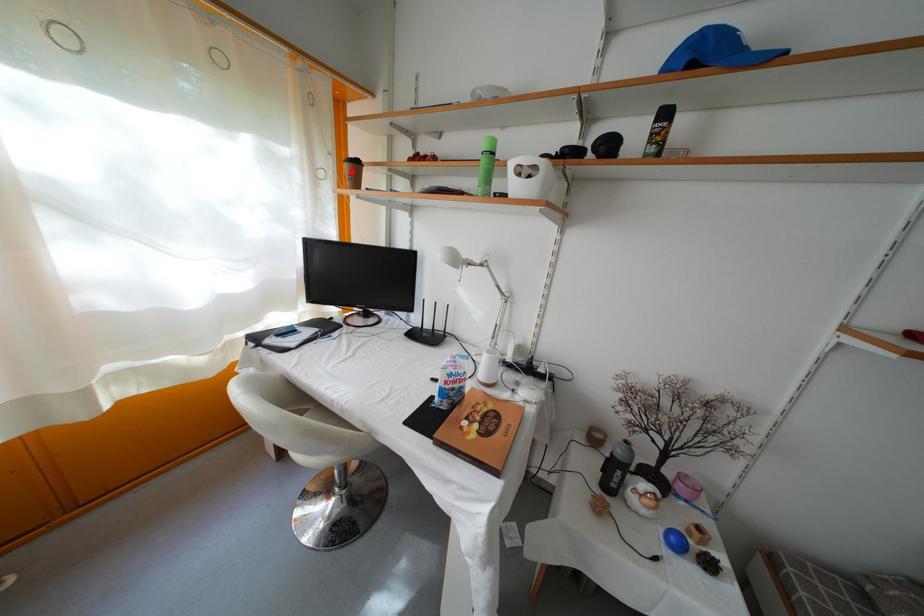
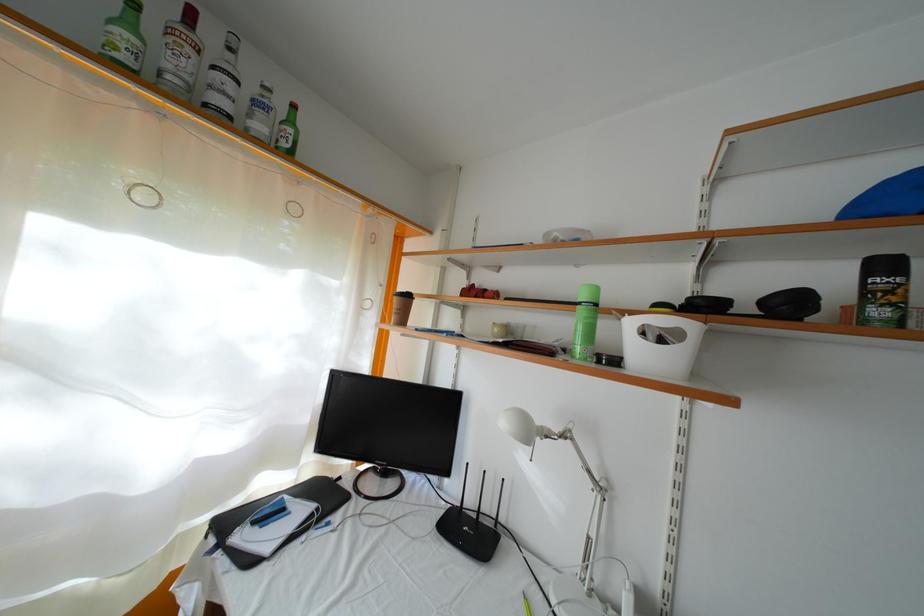
Find the pixel in the second image that matches the highlighted location in the first image.

(400, 305)